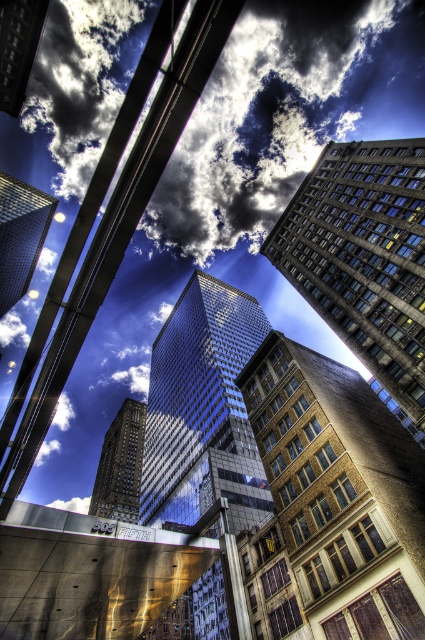
You are a drone operator trying to navigate your drone through the urban scene. You need to fly your drone from the ground level to the cloudy sky at upper center. What coordinate should you aim for?

The cloudy sky at upper center is located at coordinate point (283,115), so you should aim for that coordinate to reach it.

You are standing at the base of the central glass building and looking upwards. There are two points marked on the building facade at coordinates point (263, 164) and point (303, 259). Which point would appear closer to your eyes as you look up?

Point (263, 164) is further to the camera than point (303, 259). Therefore, point (263, 164) would appear closer to your eyes as you look up since it is physically nearer to the camera position.